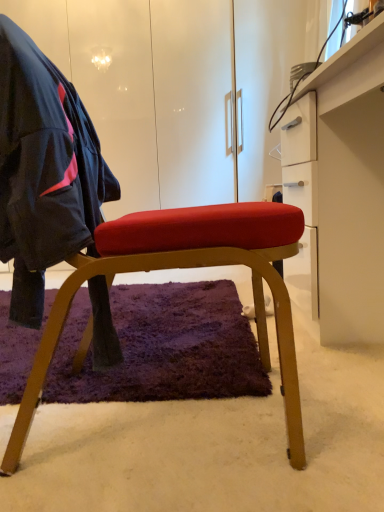
Question: Considering the relative sizes of matte wood chair at center and matte black jacket at left in the image provided, is matte wood chair at center bigger than matte black jacket at left?

Choices:
 (A) yes
 (B) no

Answer: (A)

Question: Considering the relative positions of matte wood chair at center and matte black jacket at left in the image provided, is matte wood chair at center to the left of matte black jacket at left from the viewer's perspective?

Choices:
 (A) no
 (B) yes

Answer: (A)

Question: Is matte wood chair at center smaller than matte black jacket at left?

Choices:
 (A) yes
 (B) no

Answer: (B)

Question: Can you confirm if matte wood chair at center is taller than matte black jacket at left?

Choices:
 (A) yes
 (B) no

Answer: (A)

Question: Does matte wood chair at center contain matte black jacket at left?

Choices:
 (A) yes
 (B) no

Answer: (A)

Question: In the image, is white glossy desk at right positioned in front of or behind matte wood chair at center?

Choices:
 (A) behind
 (B) front

Answer: (A)

Question: Looking at the image, does white glossy desk at right seem bigger or smaller compared to matte wood chair at center?

Choices:
 (A) small
 (B) big

Answer: (B)

Question: Looking at their shapes, would you say white glossy desk at right is wider or thinner than matte wood chair at center?

Choices:
 (A) wide
 (B) thin

Answer: (B)

Question: Is white glossy desk at right spatially inside matte wood chair at center, or outside of it?

Choices:
 (A) inside
 (B) outside

Answer: (B)

Question: In the image, is matte wood chair at center on the left side or the right side of matte black jacket at left?

Choices:
 (A) right
 (B) left

Answer: (A)

Question: From a real-world perspective, is matte wood chair at center above or below matte black jacket at left?

Choices:
 (A) below
 (B) above

Answer: (A)

Question: Relative to matte black jacket at left, is matte wood chair at center in front or behind?

Choices:
 (A) front
 (B) behind

Answer: (B)

Question: Is matte wood chair at center wider or thinner than matte black jacket at left?

Choices:
 (A) thin
 (B) wide

Answer: (B)

Question: From the image's perspective, relative to matte wood chair at center, is matte black jacket at left above or below?

Choices:
 (A) above
 (B) below

Answer: (A)

Question: Is matte black jacket at left situated inside matte wood chair at center or outside?

Choices:
 (A) inside
 (B) outside

Answer: (A)